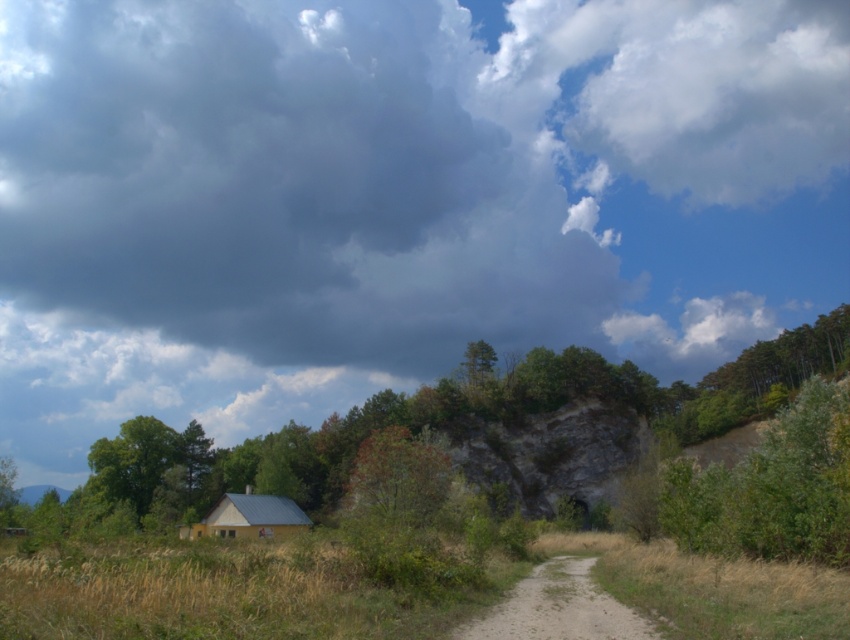
Who is shorter, dirt/gravel path at center or yellow matte hut at lower center?

yellow matte hut at lower center is shorter.

Between dirt/gravel path at center and yellow matte hut at lower center, which one has more height?

With more height is dirt/gravel path at center.

Identify the location of dirt/gravel path at center. The height and width of the screenshot is (640, 850). (558, 609).

The width and height of the screenshot is (850, 640). In order to click on dirt/gravel path at center in this screenshot , I will do `click(558, 609)`.

Locate an element on the screen. green leafy shrub at right is located at coordinates (772, 486).

Which is more to the left, reddish-brown bark tree at center or green matte tree at lower left?

green matte tree at lower left

This screenshot has width=850, height=640. Find the location of `reddish-brown bark tree at center`. reddish-brown bark tree at center is located at coordinates (400, 476).

Is point (391, 440) closer to viewer compared to point (140, 420)?

That is True.

What are the coordinates of `reddish-brown bark tree at center` in the screenshot? It's located at (400, 476).